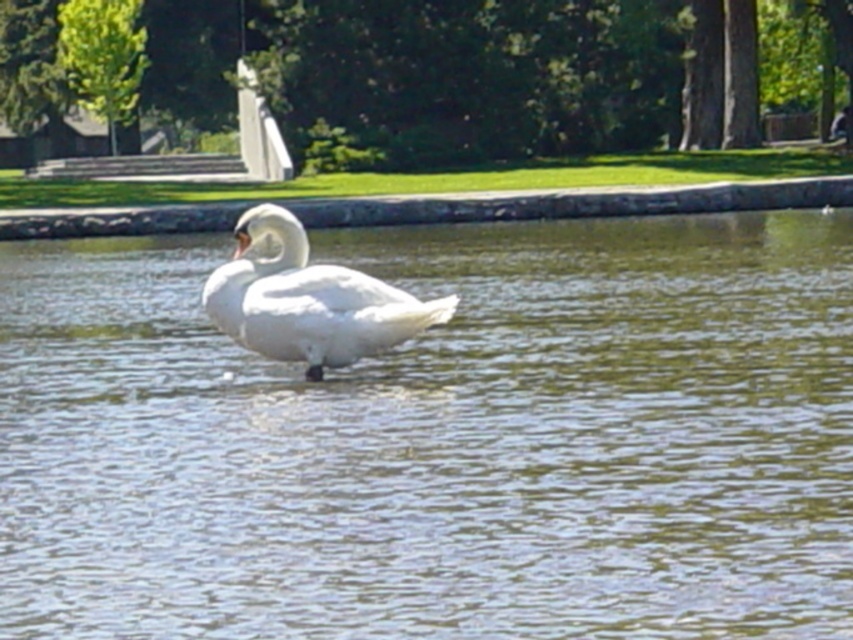
You are standing at the point labeled point [401,156] and want to reach the other point. The distance between them is 191.73 feet. If you walk at a speed of 3 feet per second, how many seconds will it take you to reach the other point?

It will take approximately 63.91 seconds to reach the other point since 191.73 divided by 3 equals approximately 63.91 seconds.

You are a photographer aiming to capture the white feathered swan at center and the white smooth swan at center in a single shot. Which swan should you focus on first if you want to ensure both are in frame without moving the camera?

The white smooth swan at center is on the left side of the white feathered swan at center, so focusing on the white smooth swan at center first would allow you to frame both swans without needing to adjust the camera position.

You are a photographer aiming to capture the white smooth swan at center in your shot. You want to ensure the clear water at center is visible in the foreground. Based on the scene, can you confirm if positioning the camera to focus on the swan will still allow the water to be seen in front?

The clear water at center is in front of the white smooth swan at center, so focusing on the swan will naturally include the water in the foreground of the image.